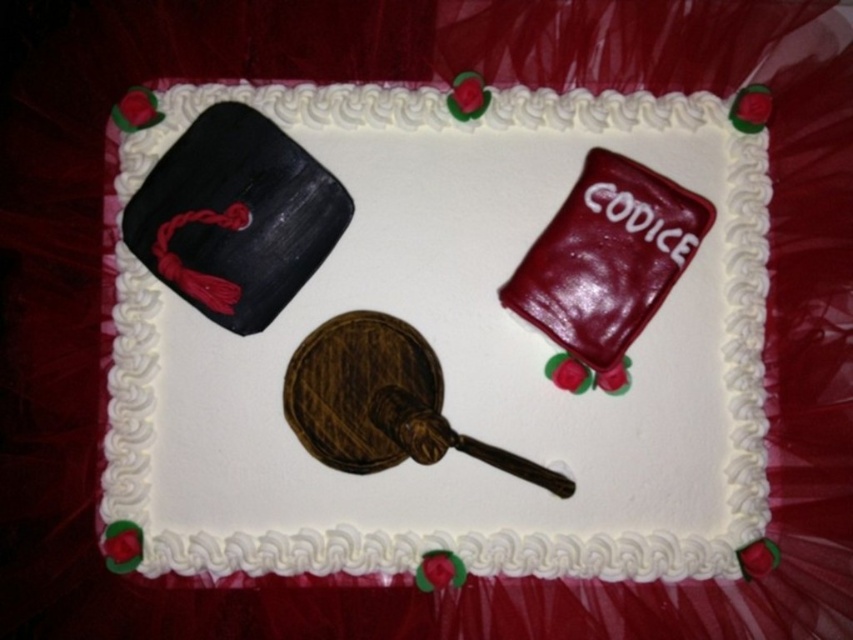
Question: Is matte black hat at upper left to the right of shiny black hat at upper left from the viewer's perspective?

Choices:
 (A) yes
 (B) no

Answer: (A)

Question: Among these objects, which one is nearest to the camera?

Choices:
 (A) shiny black hat at upper left
 (B) matte black hat at upper left

Answer: (A)

Question: Can you confirm if matte black hat at upper left is positioned to the right of shiny black hat at upper left?

Choices:
 (A) no
 (B) yes

Answer: (B)

Question: Is matte black hat at upper left thinner than shiny black hat at upper left?

Choices:
 (A) no
 (B) yes

Answer: (A)